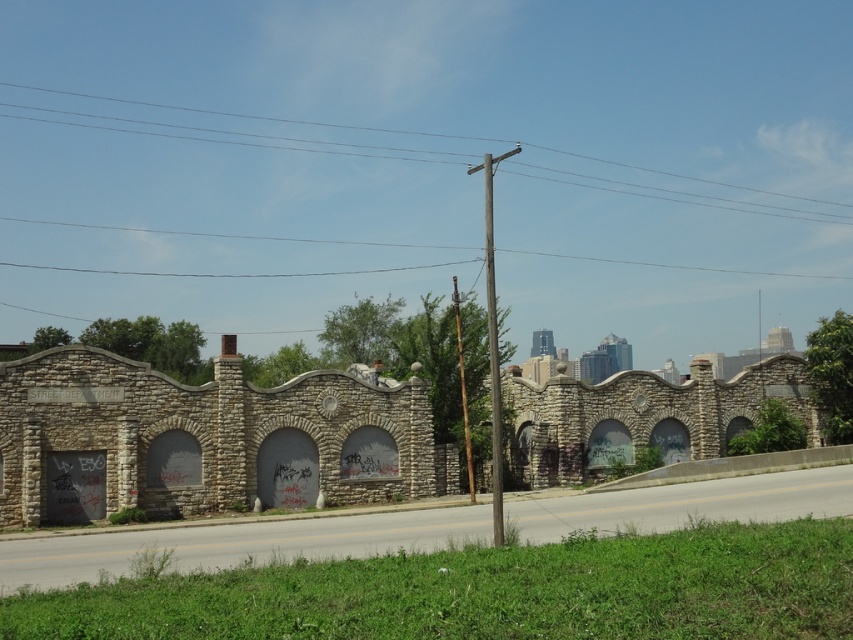
You are standing at the point with coordinates (236, 544) in the image. What object are you standing on according to the scene?

The gray concrete highway at lower center is located at point 0.858, 0.278, so you are standing on the gray concrete highway at lower center.

You are a city planner analyzing this urban area. You need to determine which object takes up more visual space in the image. Which one is larger in size between the gray concrete highway at lower center and the wooden pole at upper center?

The wooden pole at upper center occupies more visual space than the gray concrete highway at lower center, as the highway is described as occupying less space.